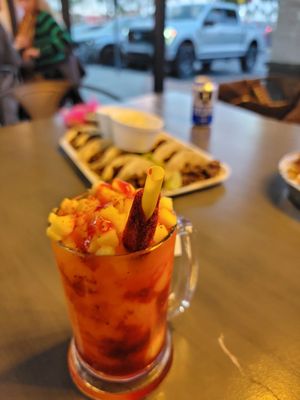
Where is `plate`? The width and height of the screenshot is (300, 400). plate is located at coordinates (81, 163).